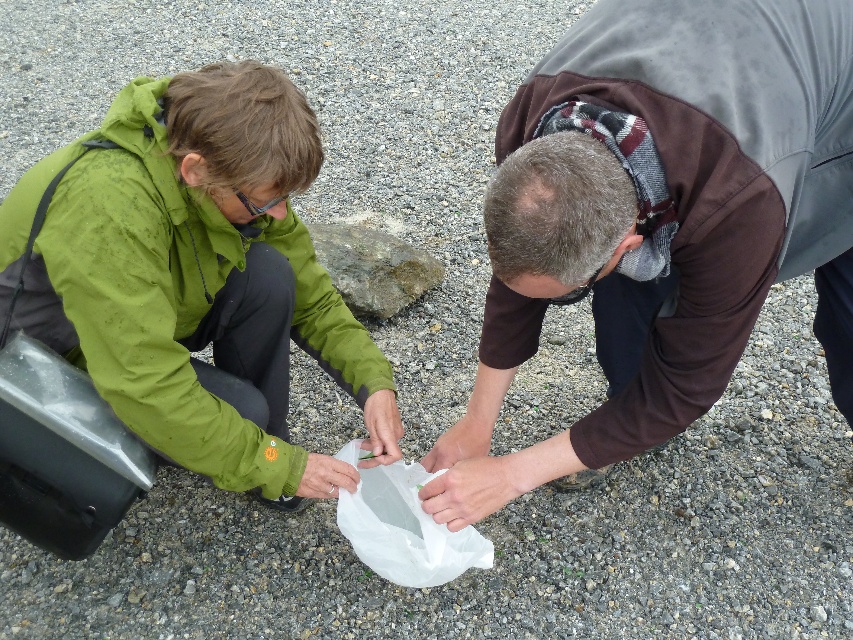
Who is positioned more to the left, brown fleece jacket at center or green matte jacket at left?

Positioned to the left is green matte jacket at left.

Can you confirm if brown fleece jacket at center is positioned above green matte jacket at left?

Yes.

Which is in front, point (477, 436) or point (148, 106)?

Point (148, 106) is in front.

Where is `brown fleece jacket at center`? brown fleece jacket at center is located at coordinates (659, 221).

Which is behind, point (535, 131) or point (410, 468)?

The point (410, 468) is behind.

The height and width of the screenshot is (640, 853). What do you see at coordinates (659, 221) in the screenshot?
I see `brown fleece jacket at center` at bounding box center [659, 221].

Between point (715, 76) and point (418, 470), which one is positioned behind?

Point (418, 470)

Where is `brown fleece jacket at center`? brown fleece jacket at center is located at coordinates (659, 221).

Can you confirm if green matte jacket at left is shorter than transparent plastic bag at center?

No, green matte jacket at left is not shorter than transparent plastic bag at center.

Does green matte jacket at left have a greater width compared to transparent plastic bag at center?

Correct, the width of green matte jacket at left exceeds that of transparent plastic bag at center.

Where is `green matte jacket at left`? The height and width of the screenshot is (640, 853). green matte jacket at left is located at coordinates (196, 278).